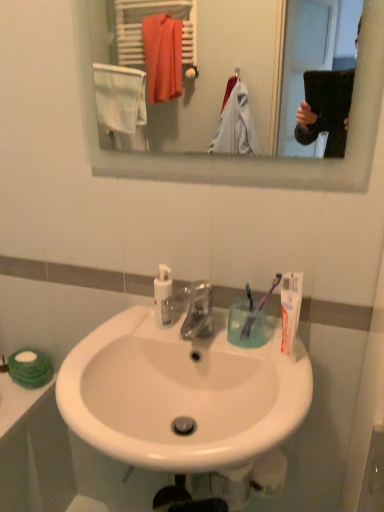
Question: Is clear glass mirror at upper center with white matte tube of toothpaste at right?

Choices:
 (A) no
 (B) yes

Answer: (A)

Question: Is the position of clear glass mirror at upper center less distant than that of white matte tube of toothpaste at right?

Choices:
 (A) yes
 (B) no

Answer: (A)

Question: Is clear glass mirror at upper center positioned far away from white matte tube of toothpaste at right?

Choices:
 (A) yes
 (B) no

Answer: (A)

Question: Does clear glass mirror at upper center have a lesser height compared to white matte tube of toothpaste at right?

Choices:
 (A) yes
 (B) no

Answer: (B)

Question: Is clear glass mirror at upper center looking in the opposite direction of white matte tube of toothpaste at right?

Choices:
 (A) yes
 (B) no

Answer: (B)

Question: From a real-world perspective, is purple plastic toothbrush at right, acting as the 2th toothbrush starting from the left, above or below white glossy sink at center?

Choices:
 (A) below
 (B) above

Answer: (B)

Question: Is purple plastic toothbrush at right, marked as the first toothbrush in a right-to-left arrangement, taller or shorter than white glossy sink at center?

Choices:
 (A) short
 (B) tall

Answer: (A)

Question: Is purple plastic toothbrush at right, acting as the 2th toothbrush starting from the left, wider or thinner than white glossy sink at center?

Choices:
 (A) thin
 (B) wide

Answer: (A)

Question: Is point (249, 313) positioned closer to the camera than point (264, 371)?

Choices:
 (A) closer
 (B) farther

Answer: (B)

Question: Is clear glass mirror at upper center to the left or to the right of clear plastic faucet at center in the image?

Choices:
 (A) left
 (B) right

Answer: (B)

Question: Is clear glass mirror at upper center taller or shorter than clear plastic faucet at center?

Choices:
 (A) tall
 (B) short

Answer: (A)

Question: Considering the positions of clear glass mirror at upper center and clear plastic faucet at center in the image, is clear glass mirror at upper center bigger or smaller than clear plastic faucet at center?

Choices:
 (A) big
 (B) small

Answer: (A)

Question: Is point (157, 125) positioned closer to the camera than point (185, 337)?

Choices:
 (A) closer
 (B) farther

Answer: (B)

Question: From a real-world perspective, relative to purple plastic toothbrush at right, acting as the 2th toothbrush starting from the left, is clear glass mirror at upper center vertically above or below?

Choices:
 (A) above
 (B) below

Answer: (A)

Question: Considering the positions of clear glass mirror at upper center and purple plastic toothbrush at right, acting as the 2th toothbrush starting from the left, in the image, is clear glass mirror at upper center taller or shorter than purple plastic toothbrush at right, acting as the 2th toothbrush starting from the left,?

Choices:
 (A) tall
 (B) short

Answer: (A)